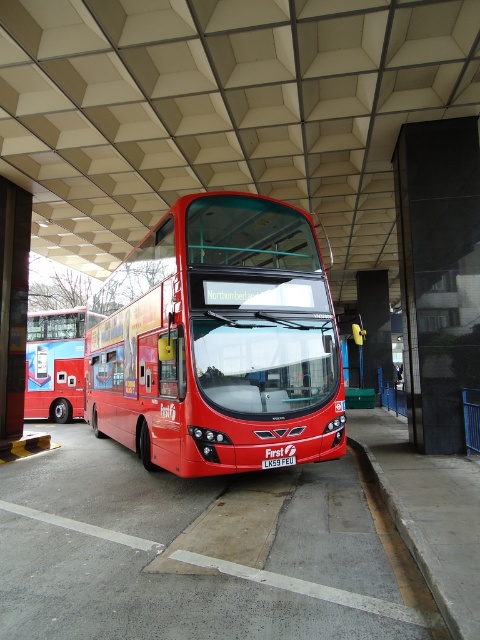
Where is `shiny red bus at center`? The image size is (480, 640). shiny red bus at center is located at coordinates pos(217,342).

Which is in front, point (220, 330) or point (78, 365)?

Positioned in front is point (220, 330).

Find the location of a particular element. The height and width of the screenshot is (640, 480). shiny red bus at center is located at coordinates (217, 342).